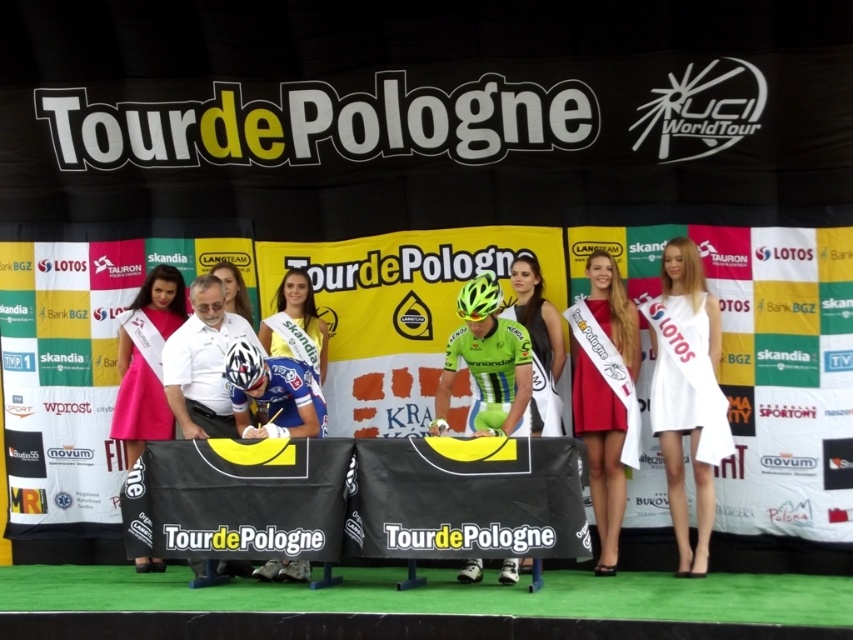
Is green jersey at center positioned before yellow jersey at center?

Yes.

What do you see at coordinates (538, 342) in the screenshot? This screenshot has width=853, height=640. I see `green jersey at center` at bounding box center [538, 342].

I want to click on green jersey at center, so click(538, 342).

From the picture: Is white satin dress at center further to the viewer compared to yellow-green matte bicycle helmet at center?

Yes, white satin dress at center is further from the viewer.

Is white satin dress at center below yellow-green matte bicycle helmet at center?

Yes, white satin dress at center is below yellow-green matte bicycle helmet at center.

This screenshot has width=853, height=640. What do you see at coordinates (683, 392) in the screenshot?
I see `white satin dress at center` at bounding box center [683, 392].

Where is `white satin dress at center`? The width and height of the screenshot is (853, 640). white satin dress at center is located at coordinates (683, 392).

Is blue jersey at center to the left of green jersey at center from the viewer's perspective?

Correct, you'll find blue jersey at center to the left of green jersey at center.

Does point (270, 392) come in front of point (537, 317)?

Yes, point (270, 392) is closer to viewer.

Locate an element on the screen. The image size is (853, 640). blue jersey at center is located at coordinates [x=274, y=394].